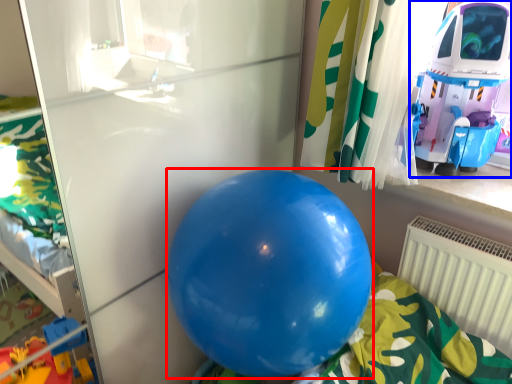
Question: Which object appears farthest to the camera in this image, balloon (highlighted by a red box) or toy (highlighted by a blue box)?

Choices:
 (A) balloon
 (B) toy

Answer: (B)